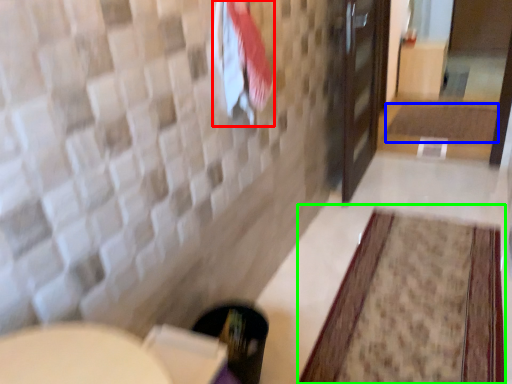
Question: Based on their relative distances, which object is farther from beach towel (highlighted by a red box)? Choose from bath mat (highlighted by a blue box) and bath mat (highlighted by a green box).

Choices:
 (A) bath mat
 (B) bath mat

Answer: (A)